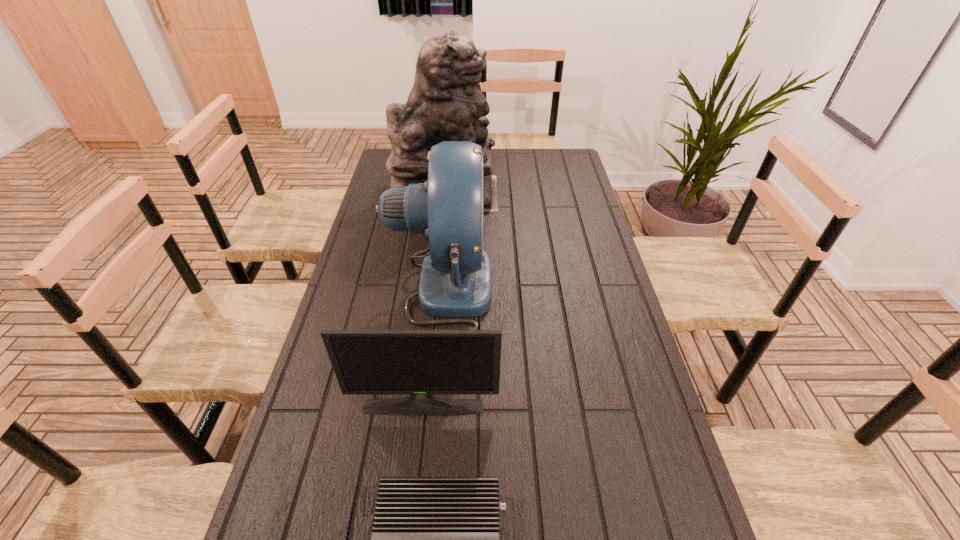
Select which object appears as the second closest to the tallest object. Please provide its 2D coordinates. Your answer should be formatted as a tuple, i.e. [(x, y)], where the tuple contains the x and y coordinates of a point satisfying the conditions above.

[(366, 362)]